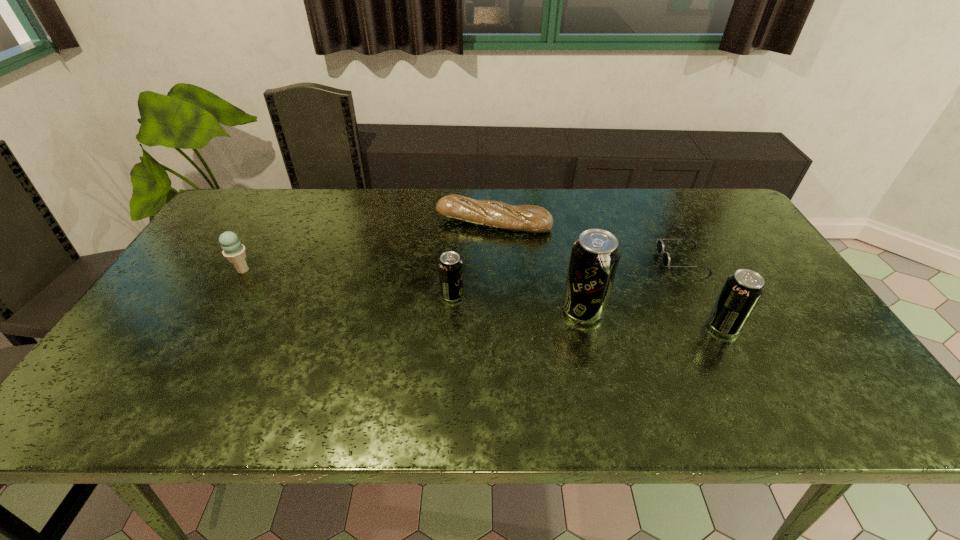
Where is `vacant place for an extra soda can on the left`? vacant place for an extra soda can on the left is located at coordinates (330, 281).